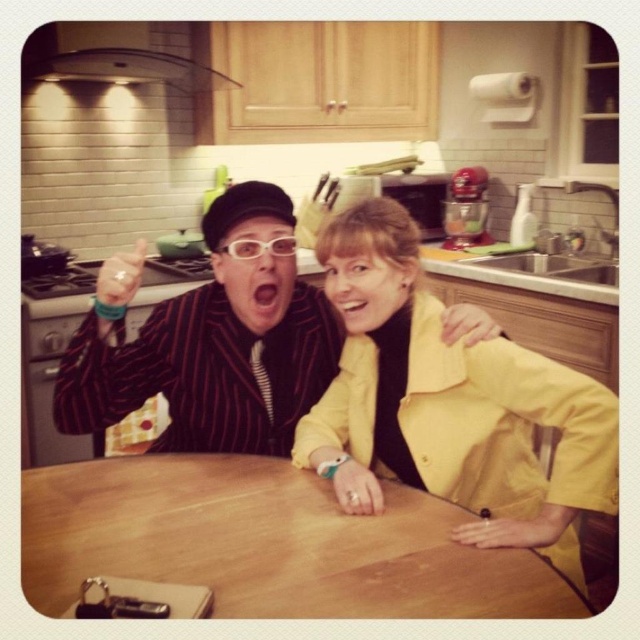
Between point (150, 323) and point (125, 300), which one is positioned in front?

Point (125, 300) is more forward.

Find the location of a particular element. The image size is (640, 640). yellow matte jacket at center is located at coordinates (209, 340).

Find the location of a particular element. The image size is (640, 640). yellow matte jacket at center is located at coordinates (209, 340).

Based on the photo, who is shorter, wooden table at center or striped fabric suit at center?

wooden table at center

Where is `wooden table at center`? This screenshot has height=640, width=640. wooden table at center is located at coordinates (268, 544).

You are a GUI agent. You are given a task and a screenshot of the screen. Output one action in this format:
    pyautogui.click(x=<x>, y=<y>)
    Task: Click on the wooden table at center
    
    Given the screenshot: What is the action you would take?
    pyautogui.click(x=268, y=544)

Is wooden table at center positioned before yellow matte jacket at center?

Yes, it is in front of yellow matte jacket at center.

Between point (214, 563) and point (332, 353), which one is positioned behind?

Point (332, 353)

Where is `wooden table at center`? The width and height of the screenshot is (640, 640). wooden table at center is located at coordinates (268, 544).